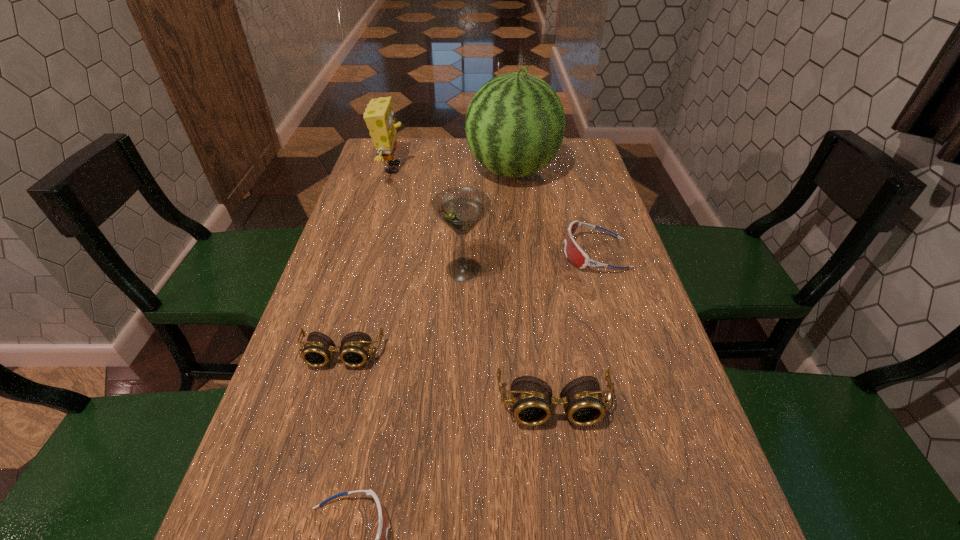
Locate an element on the screen. This screenshot has width=960, height=540. watermelon is located at coordinates (515, 124).

The height and width of the screenshot is (540, 960). Find the location of `the tallest object`. the tallest object is located at coordinates (515, 124).

The width and height of the screenshot is (960, 540). In order to click on martini in this screenshot , I will do `click(461, 208)`.

Identify the location of sponge. This screenshot has width=960, height=540. (379, 117).

Locate an element on the screen. The height and width of the screenshot is (540, 960). the third farthest goggles is located at coordinates (531, 398).

Locate an element on the screen. the tallest goggles is located at coordinates (531, 398).

Locate an element on the screen. This screenshot has width=960, height=540. the farther red goggles is located at coordinates (573, 252).

Locate an element on the screen. the bigger red goggles is located at coordinates tap(573, 252).

Identify the location of the left brown goggles. This screenshot has height=540, width=960. (355, 348).

Locate an element on the screen. The image size is (960, 540). the smaller brown goggles is located at coordinates (355, 348).